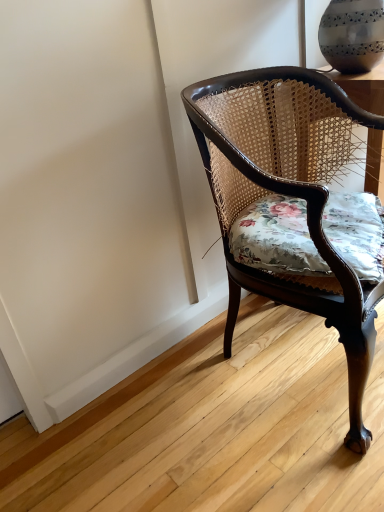
Identify the location of blank area to the left of mahogany cane chair at center. The width and height of the screenshot is (384, 512). (157, 420).